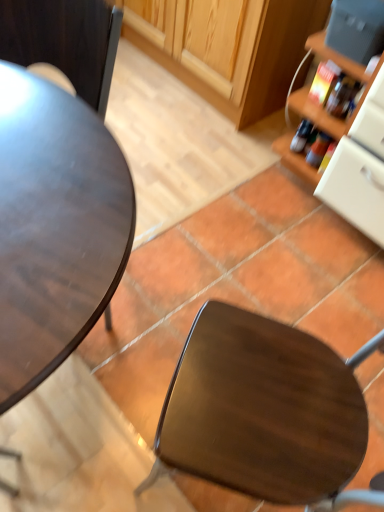
Where is `free point to the right of matte dark wood desk at left`? The height and width of the screenshot is (512, 384). free point to the right of matte dark wood desk at left is located at coordinates (174, 265).